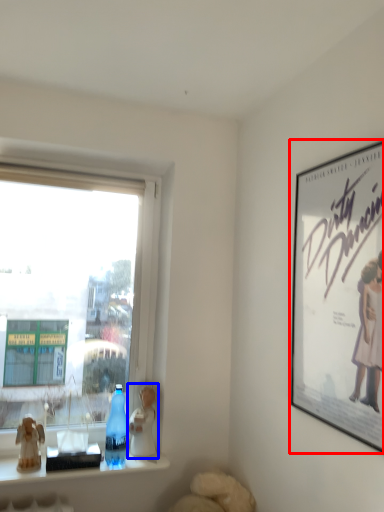
Question: Which of the following is the closest to the observer, picture frame (highlighted by a red box) or figurine (highlighted by a blue box)?

Choices:
 (A) picture frame
 (B) figurine

Answer: (A)